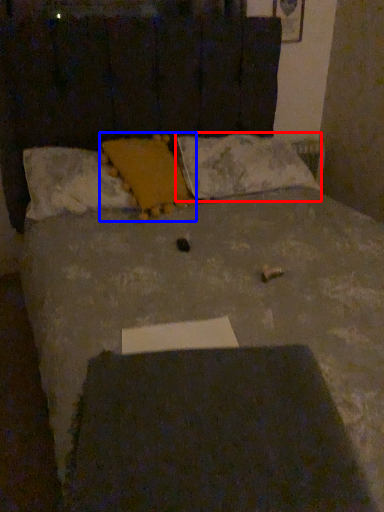
Question: Which object appears closest to the camera in this image, pillow (highlighted by a red box) or pillow (highlighted by a blue box)?

Choices:
 (A) pillow
 (B) pillow

Answer: (B)